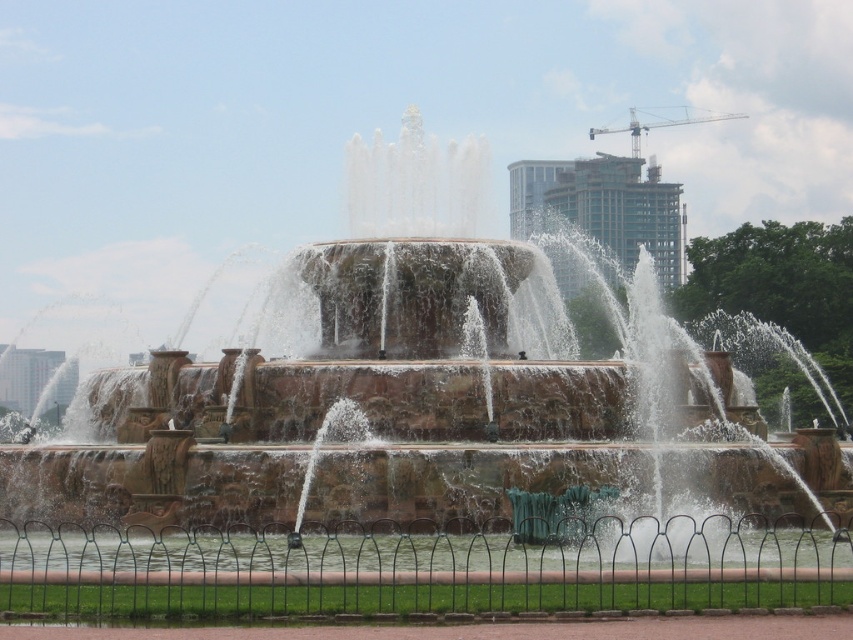
Who is more forward, (222, 364) or (218, 556)?

Point (218, 556) is in front.

Between brown stone fountain at center and clear water at center, which one appears on the left side from the viewer's perspective?

Positioned to the left is brown stone fountain at center.

Locate an element on the screen. This screenshot has height=640, width=853. brown stone fountain at center is located at coordinates (430, 401).

Where is `brown stone fountain at center`? This screenshot has height=640, width=853. brown stone fountain at center is located at coordinates (430, 401).